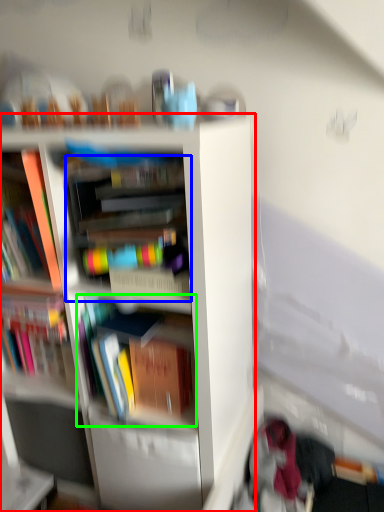
Question: Which object is positioned closest to bookcase (highlighted by a red box)? Select from book (highlighted by a blue box) and book (highlighted by a green box).

Choices:
 (A) book
 (B) book

Answer: (B)